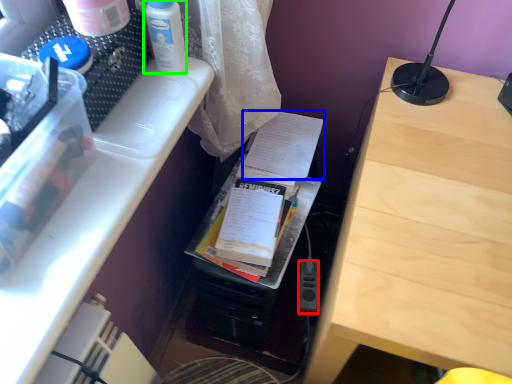
Question: Which object is the closest to the power plugs and sockets (highlighted by a red box)? Choose among these: document (highlighted by a blue box) or bottle (highlighted by a green box).

Choices:
 (A) document
 (B) bottle

Answer: (A)